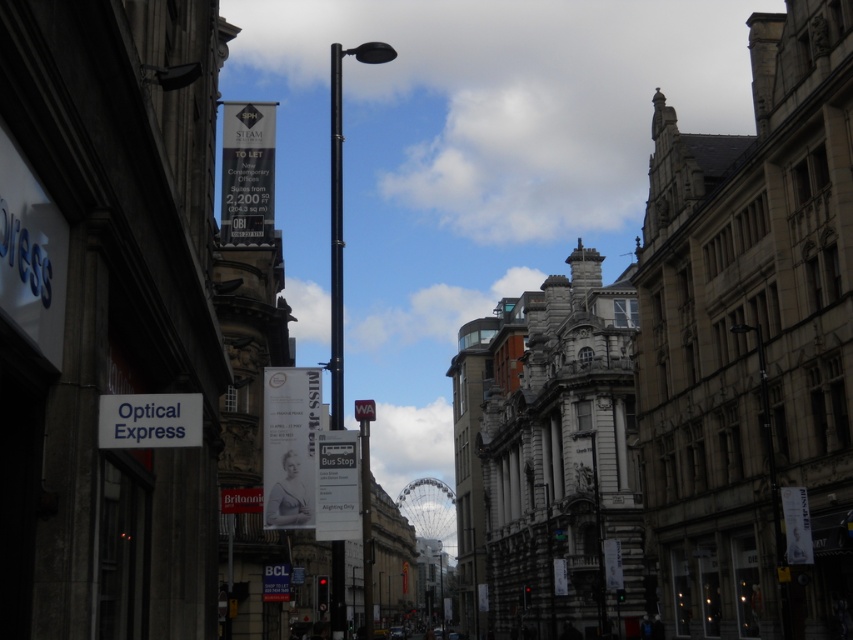
You are a city planner assessing the street layout. You notice the black metal pole at center and the white plastic street sign at center. Which object would require more space in terms of physical dimensions when installing them side by side?

The black metal pole at center has a larger size compared to the white plastic street sign at center, so it would require more space when installing them side by side.

You are a tourist holding a map and looking at the white matte sign at lower left and the white plastic street sign at center. Which sign is placed higher up on the wall?

The white matte sign at lower left is positioned over the white plastic street sign at center, so it is placed higher up on the wall.

You are a delivery person trying to read two signs on the street. One is the white matte sign at lower left and the other is the white plastic street sign at center. Which one is shorter in height?

The white matte sign at lower left has a lesser height compared to the white plastic street sign at center, so the white matte sign at lower left is shorter.